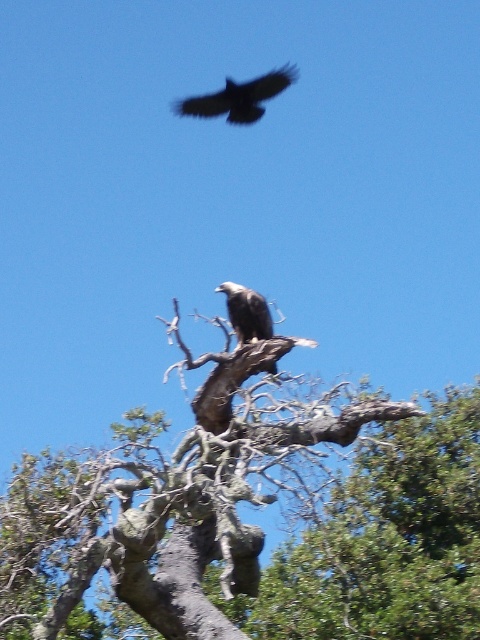
Does gray bark tree trunk at center appear on the right side of dark brown eagle at upper center?

Indeed, gray bark tree trunk at center is positioned on the right side of dark brown eagle at upper center.

Is gray bark tree trunk at center positioned in front of dark brown eagle at upper center?

That is True.

In the scene shown: Who is more forward, (61, 496) or (247, 104)?

Point (61, 496)

Identify the location of gray bark tree trunk at center. click(x=251, y=524).

Locate an element on the screen. The height and width of the screenshot is (640, 480). gray bark tree trunk at center is located at coordinates (251, 524).

Which is below, gray bark tree trunk at center or dark brown feathers at center?

Positioned lower is gray bark tree trunk at center.

Between point (243, 428) and point (217, 285), which one is positioned behind?

The point (217, 285) is behind.

The image size is (480, 640). Identify the location of gray bark tree trunk at center. (251, 524).

Is point (236, 88) behind point (252, 332)?

Yes, it is behind point (252, 332).

Can you confirm if dark brown eagle at upper center is positioned below dark brown feathers at center?

No.

Between point (254, 109) and point (243, 294), which one is positioned behind?

Positioned behind is point (254, 109).

The image size is (480, 640). In order to click on dark brown eagle at upper center in this screenshot , I will do [239, 97].